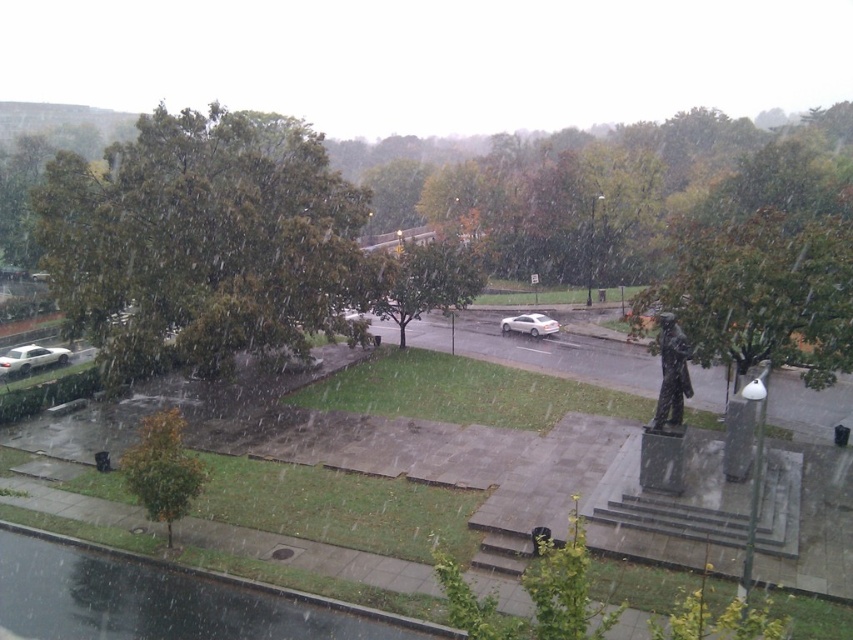
Question: Which point appears closest to the camera in this image?

Choices:
 (A) (78, 269)
 (B) (386, 307)
 (C) (163, 461)
 (D) (38, 356)

Answer: (C)

Question: Does green leafy tree at center have a greater width compared to green matte tree at lower left?

Choices:
 (A) no
 (B) yes

Answer: (B)

Question: Which point appears closest to the camera in this image?

Choices:
 (A) (433, 298)
 (B) (543, 321)

Answer: (A)

Question: Does green leafy tree at upper left appear on the right side of green leafy tree at center?

Choices:
 (A) no
 (B) yes

Answer: (A)

Question: Considering the real-world distances, which object is farthest from the green leafy tree at center?

Choices:
 (A) green matte tree at lower left
 (B) white glossy sedan at lower left

Answer: (B)

Question: Is white glossy sedan at lower left thinner than satin silver sedan at center?

Choices:
 (A) yes
 (B) no

Answer: (A)